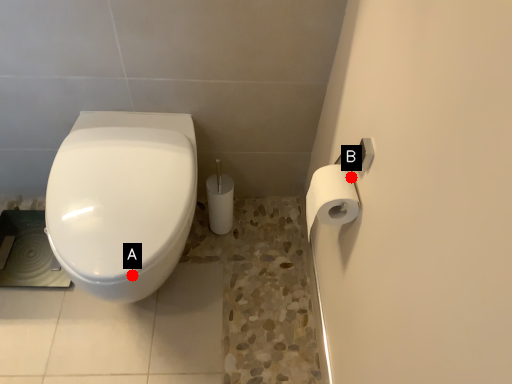
Question: Two points are circled on the image, labeled by A and B beside each circle. Which of the following is the closest to the observer?

Choices:
 (A) A is closer
 (B) B is closer

Answer: (B)